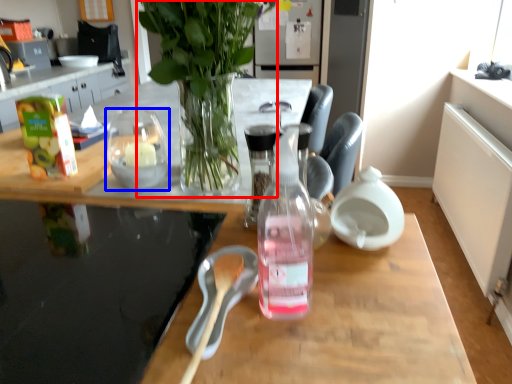
Question: Which of the following is the farthest to the observer, houseplant (highlighted by a red box) or tableware (highlighted by a blue box)?

Choices:
 (A) houseplant
 (B) tableware

Answer: (B)